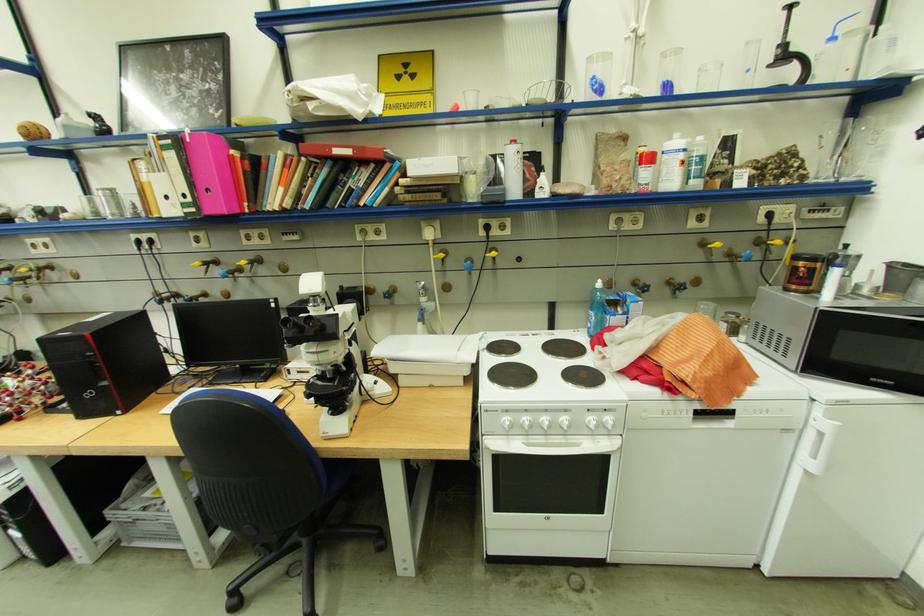
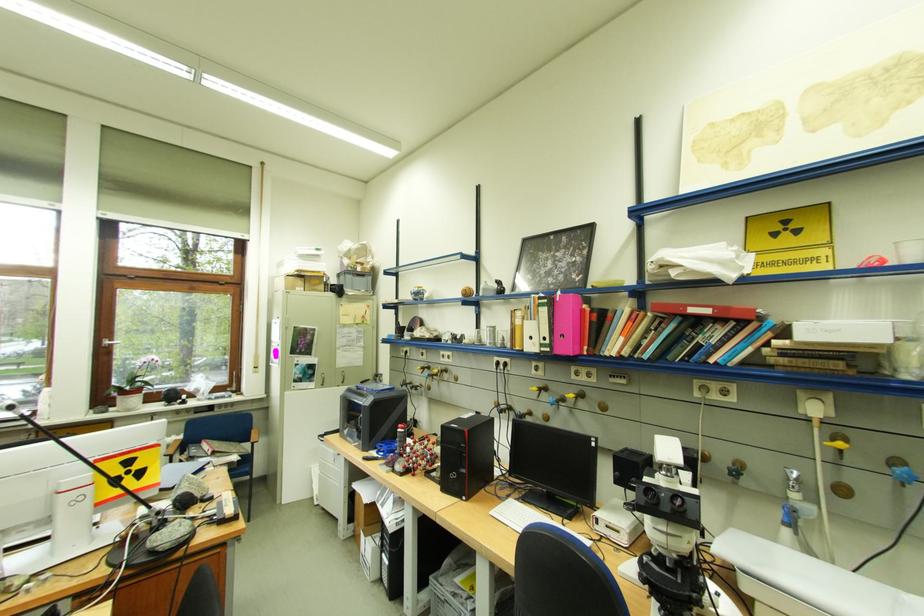
Where in the second image is the point corresponding to point (329, 351) from the first image?

(681, 533)